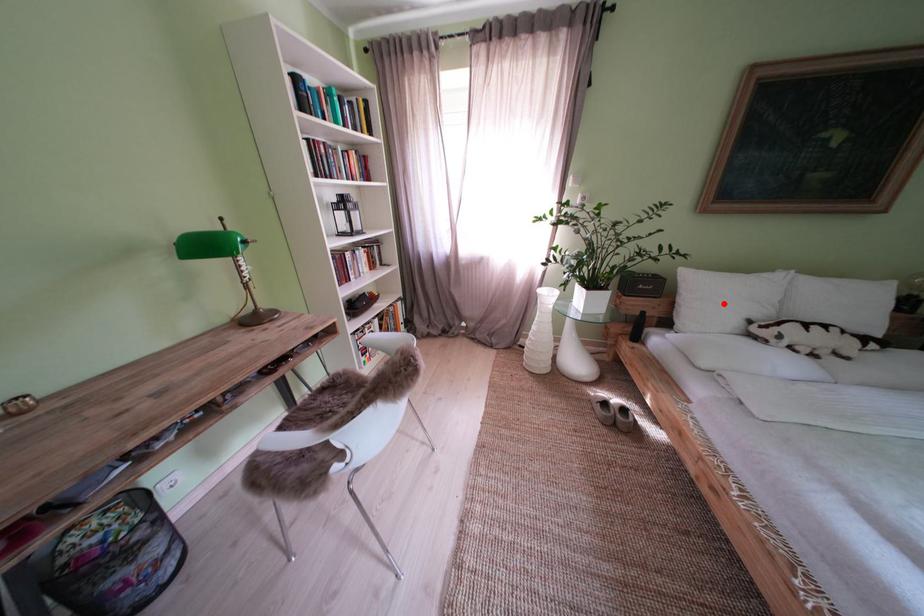
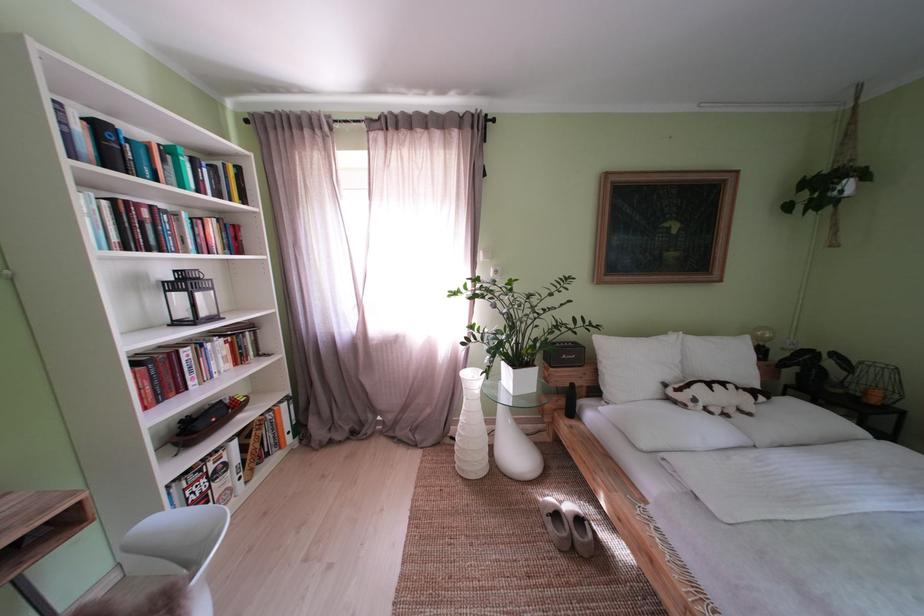
Question: I am providing you with two images of the same scene from different viewpoints. Given a red point in image1, look at the same physical point in image2. Is it:

Choices:
 (A) Closer to the viewpoint
 (B) Farther from the viewpoint

Answer: (B)